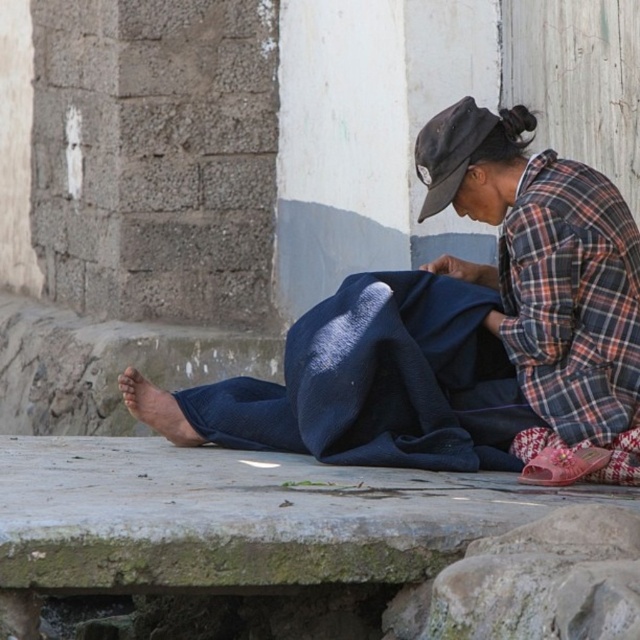
The width and height of the screenshot is (640, 640). What do you see at coordinates (458, 330) in the screenshot?
I see `matte blue fabric at center` at bounding box center [458, 330].

Between matte blue fabric at center and pink fabric sandal at lower right, which one is positioned lower?

Positioned lower is pink fabric sandal at lower right.

Which is in front, point (458, 116) or point (552, 458)?

Positioned in front is point (552, 458).

Where is `matte blue fabric at center`? Image resolution: width=640 pixels, height=640 pixels. matte blue fabric at center is located at coordinates (458, 330).

Does plaid fabric at lower right have a smaller size compared to pink fabric sandal at lower right?

Actually, plaid fabric at lower right might be larger than pink fabric sandal at lower right.

Who is positioned more to the left, plaid fabric at lower right or pink fabric sandal at lower right?

From the viewer's perspective, pink fabric sandal at lower right appears more on the left side.

Who is more distant from viewer, (552, 273) or (564, 465)?

The point (552, 273) is more distant.

I want to click on plaid fabric at lower right, so (x=573, y=310).

In the scene shown: Is black fabric hat at upper center positioned behind pink fabric sandal at lower right?

Yes, it is behind pink fabric sandal at lower right.

Which is below, black fabric hat at upper center or pink fabric sandal at lower right?

pink fabric sandal at lower right

Image resolution: width=640 pixels, height=640 pixels. I want to click on black fabric hat at upper center, so click(449, 150).

Locate an element on the screen. The image size is (640, 640). black fabric hat at upper center is located at coordinates (449, 150).